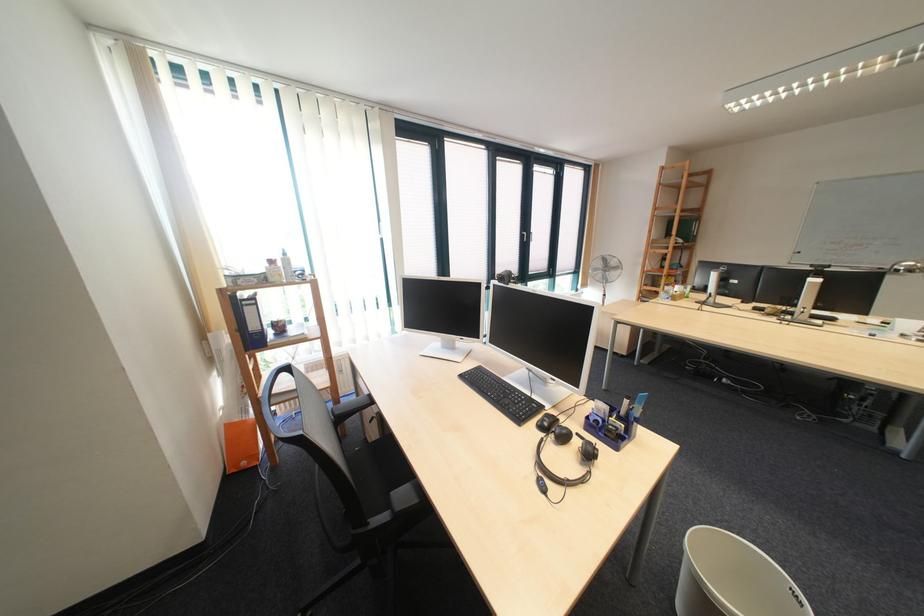
The width and height of the screenshot is (924, 616). Find the location of `black headphones`. black headphones is located at coordinates click(x=562, y=451).